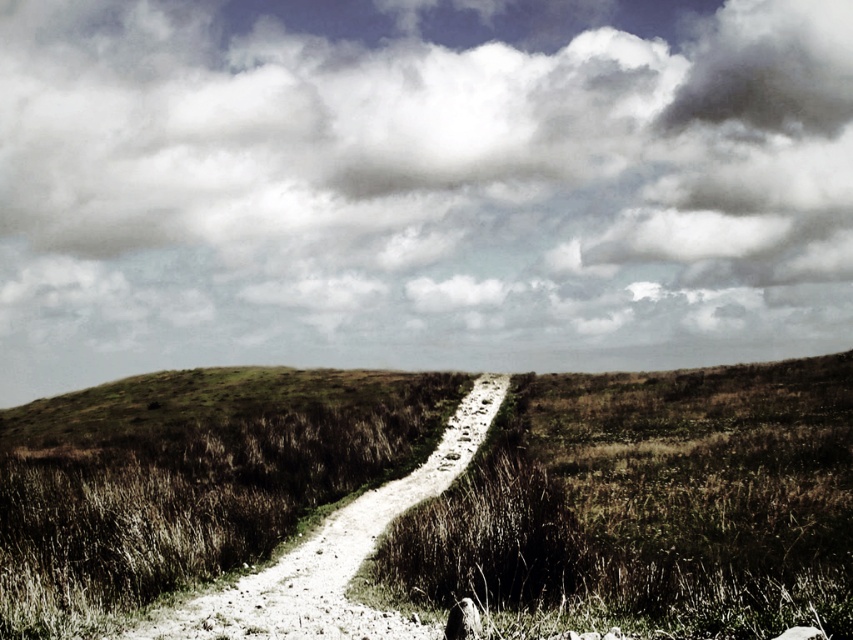
You are a drone operator trying to capture a photo of the point at coordinates (421, 186) in the image. According to the scene description, where should you position the camera to ensure the point is visible in the photo?

The point at coordinates (421, 186) is located on the cloudy sky at upper center. To capture it, position the camera so the upper center area of the image is framed, focusing on the clouds in that region.

Consider the image. You are a hiker planning to walk along the white gravel trail at center. You notice the cloudy sky at upper center. Which one is wider in the image?

The cloudy sky at upper center is wider than the white gravel trail at center according to the description.